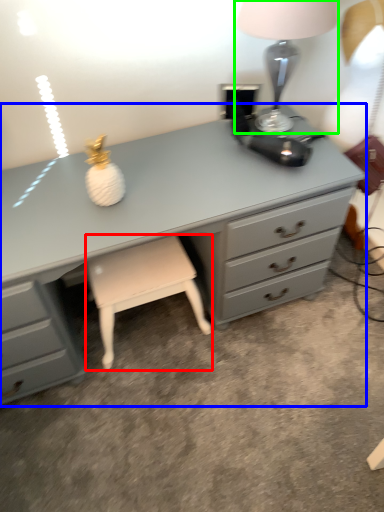
Question: Which object is the closest to the stool (highlighted by a red box)? Choose among these: chest of drawers (highlighted by a blue box) or table lamp (highlighted by a green box).

Choices:
 (A) chest of drawers
 (B) table lamp

Answer: (A)